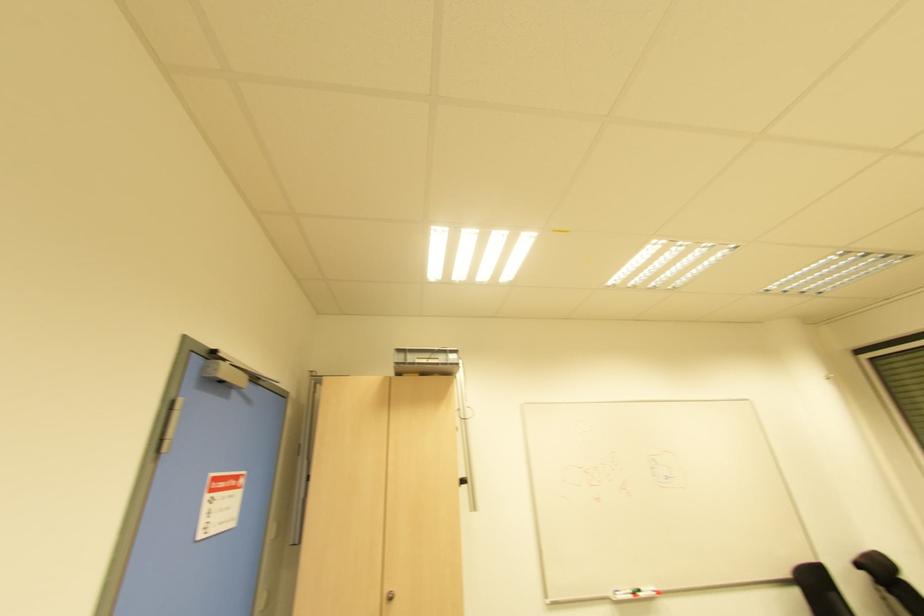
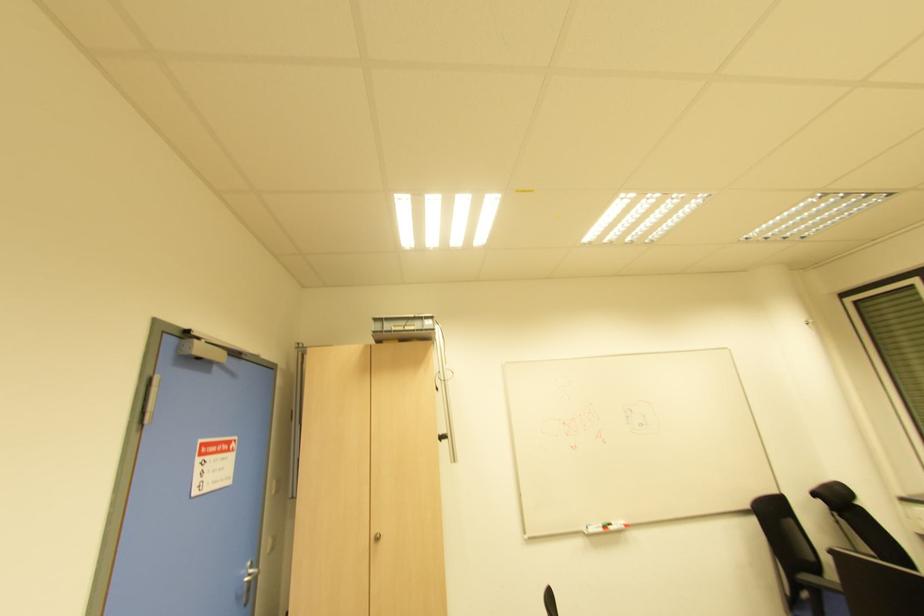
Question: What movement of the cameraman would produce the second image?

Choices:
 (A) Left
 (B) Right
 (C) Forward
 (D) Backward

Answer: (B)